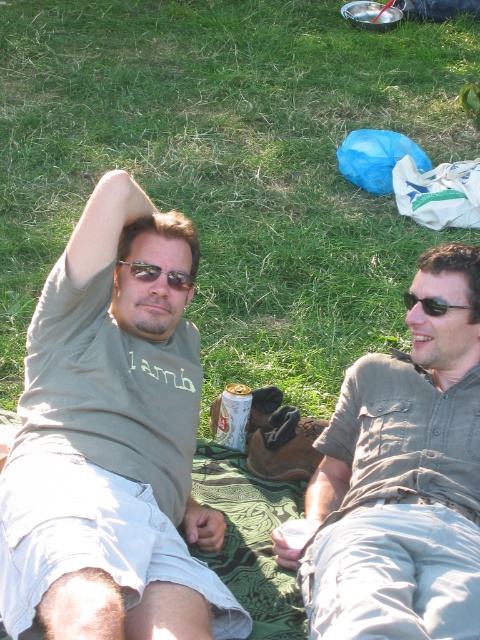
You are a photographer trying to capture a candid shot of the matte khaki shirt at upper left and the black plastic sunglasses at right. Since you want both subjects to be in focus, you need to know their relative heights. Which object is taller?

The matte khaki shirt at upper left is much taller than the black plastic sunglasses at right, so you should adjust your camera settings to ensure both are in focus by focusing on the matte khaki shirt at upper left.